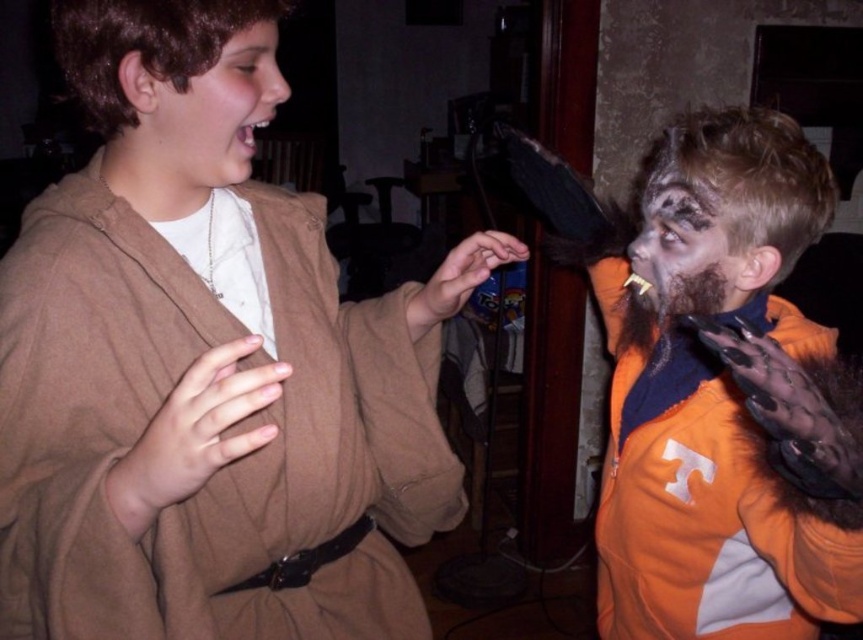
Consider the image. You are a photographer setting up a photo shoot in a studio. You have two props to place in the scene, the brown matte robe at upper left and the orange fuzzy jacket at right. The minimum distance required between the two props is 16 inches to avoid visual clutter. Based on the current setup, will you need to adjust their positions?

The brown matte robe at upper left is 15.01 inches away from the orange fuzzy jacket at right, which is less than the required 16 inches. Therefore, you need to adjust their positions to increase the distance between them.

You are a photographer setting up a shoot in this scene. You need to ensure that the brown matte robe at upper left and the orange fuzzy jacket at right are both visible in the frame. Given their widths, which object should you position closer to the camera to maintain their visibility without cropping?

The brown matte robe at upper left is wider than the orange fuzzy jacket at right. To maintain visibility without cropping, position the brown matte robe at upper left closer to the camera since its greater width requires more space in the frame.

You are a costume designer preparing for a play and need to decide which prop to place first. Since the orange fuzzy jacket at right is larger than the brown fuzzy beard at right, which prop should you place first to ensure proper fitting?

The orange fuzzy jacket at right should be placed first because it is larger than the brown fuzzy beard at right, ensuring proper fitting.